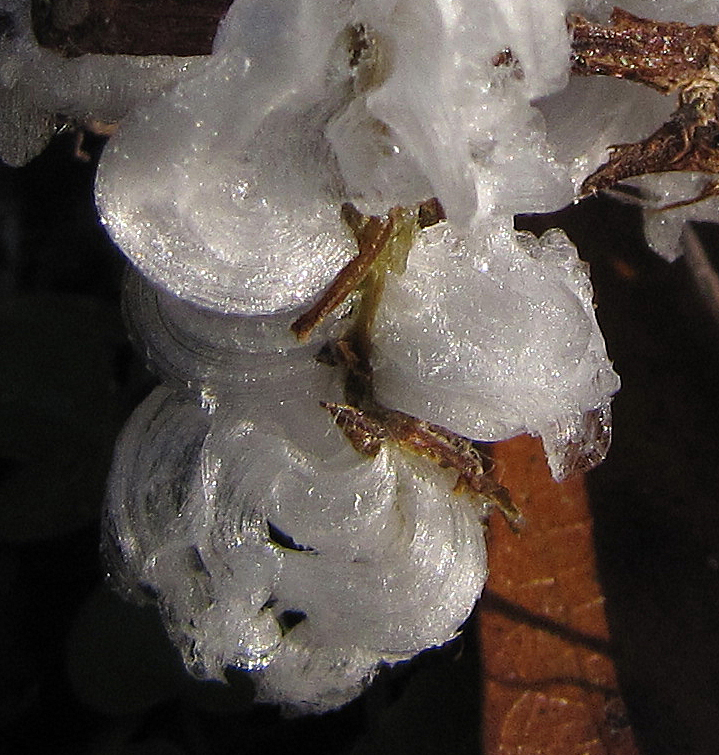
Locate an element on the screen. The width and height of the screenshot is (719, 755). illuminated stripe is located at coordinates (543, 587).